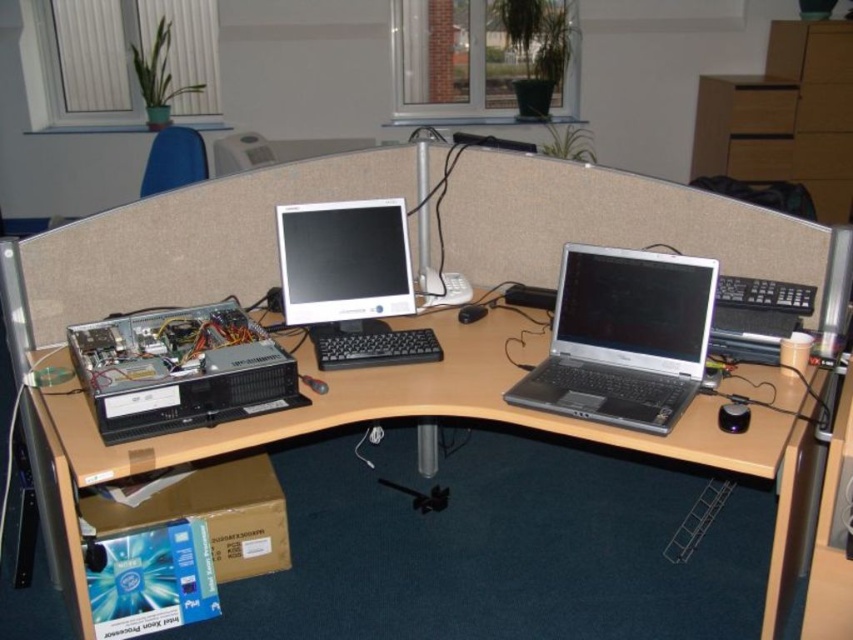
Question: Is black plastic desktop computer at lower left to the right of satin black monitor at center from the viewer's perspective?

Choices:
 (A) no
 (B) yes

Answer: (A)

Question: Does satin black monitor at center have a smaller size compared to black plastic keyboard at center?

Choices:
 (A) no
 (B) yes

Answer: (A)

Question: Can you confirm if black plastic desktop computer at lower left is smaller than black plastic mouse at center?

Choices:
 (A) yes
 (B) no

Answer: (B)

Question: Estimate the real-world distances between objects in this image. Which object is closer to the wooden at center?

Choices:
 (A) silver/black plastic laptop at center-right
 (B) black plastic mouse at center

Answer: (A)

Question: Which point is farther to the camera?

Choices:
 (A) black plastic desktop computer at lower left
 (B) black plastic keyboard at center
 (C) wooden at center
 (D) silver/black plastic laptop at center-right

Answer: (B)

Question: Among these points, which one is nearest to the camera?

Choices:
 (A) (315, 296)
 (B) (119, 332)
 (C) (724, 440)
 (D) (350, 346)

Answer: (C)